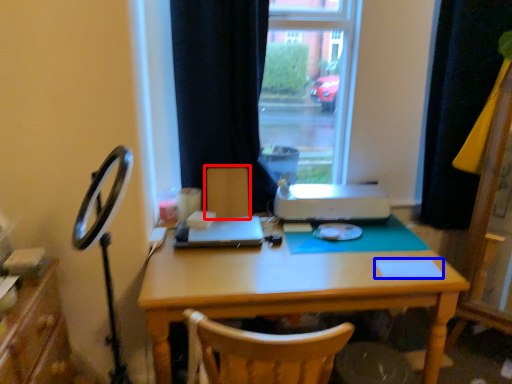
Question: Which of the following is the closest to the observer, armchair (highlighted by a red box) or notepad (highlighted by a blue box)?

Choices:
 (A) armchair
 (B) notepad

Answer: (B)